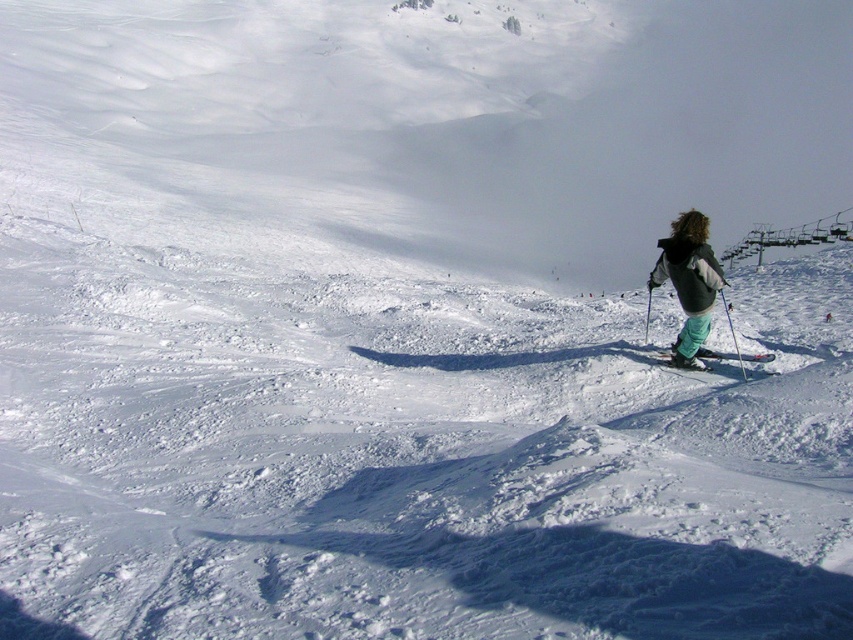
You are standing at point A located at coordinates point A at (711, 260). You want to reach point B, which is 11.66 meters away from you. Can you estimate how far you need to walk to reach point B?

The distance between point A at (711, 260) and point B is 11.66 meters, so you need to walk approximately 11.66 meters to reach point B.

From the picture: You are navigating a drone along a path between the two points, point (788, 230) and point (701, 355). The drone has a limited battery and can only ascend or descend 0.1 units vertically. Given the terrain described in the scene, which point should the drone start from to ensure it can complete the path without running out of battery?

The drone should start from point (701, 355) because point (788, 230) is further to the viewer, meaning it is closer to the drone. Starting from the farther point allows the drone to ascend or descend within the 0.1 unit limit as it moves towards the closer point.

You are a skier trying to reach the metallic gray ski lift at upper right from the green fabric ski at center. Given that your average speed is 5 meters per second, how long will it take you to reach the ski lift?

The distance between the metallic gray ski lift at upper right and the green fabric ski at center is 23.07 meters. At an average speed of 5 meters per second, it would take approximately 4.61 seconds to reach the ski lift.